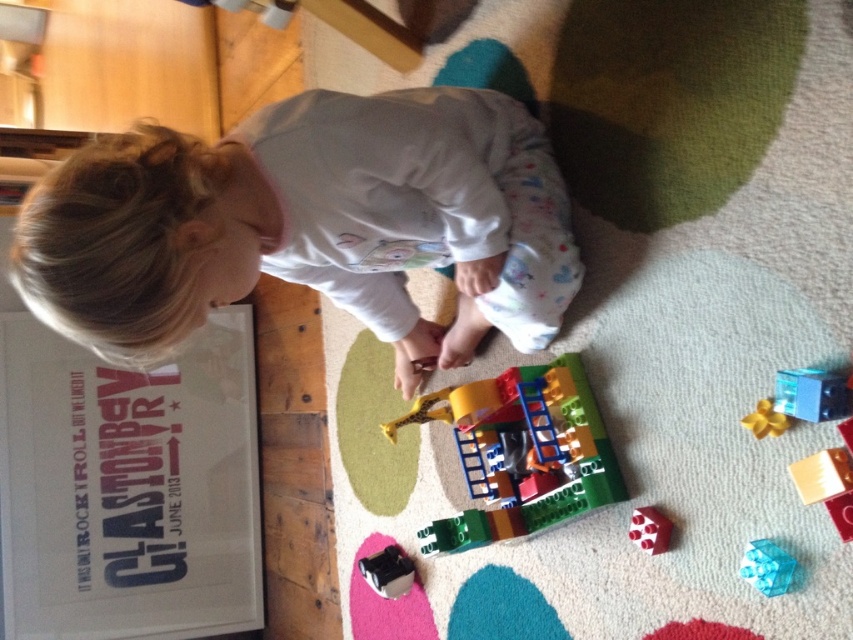
Question: Which point is closer to the camera?

Choices:
 (A) translucent plastic building at center
 (B) translucent yellow star at lower right
 (C) white soft baby at center
 (D) transparent plastic cube at lower right

Answer: (C)

Question: Observing the image, what is the correct spatial positioning of translucent plastic cube at lower right in reference to black plastic toy at lower center?

Choices:
 (A) below
 (B) above

Answer: (B)

Question: Can you confirm if translucent plastic cube at lower right is thinner than black plastic toy at lower center?

Choices:
 (A) no
 (B) yes

Answer: (B)

Question: Which object is closer to the camera taking this photo?

Choices:
 (A) translucent yellow star at lower right
 (B) black plastic toy at lower center

Answer: (A)

Question: Which of the following is the closest to the observer?

Choices:
 (A) (831, 496)
 (B) (378, 593)
 (C) (489, 412)

Answer: (A)

Question: Can you confirm if rubber brick at center is bigger than translucent yellow star at lower right?

Choices:
 (A) yes
 (B) no

Answer: (A)